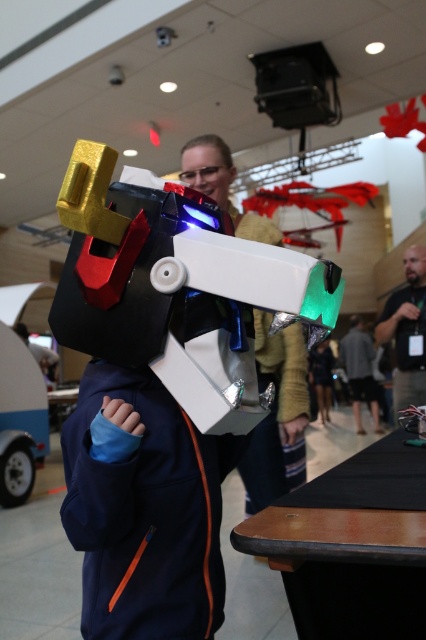
Between dark brown hair at center and matte black helmet at center, which one has less height?

Standing shorter between the two is matte black helmet at center.

Is point (414, 248) farther from viewer compared to point (353, 326)?

No, it is not.

Does point (411, 262) come behind point (353, 317)?

No.

At what (x,y) coordinates should I click in order to perform the action: click on dark brown hair at center. Please return your answer as a coordinate pair (x, y). This screenshot has height=640, width=426. Looking at the image, I should click on (414, 264).

Is point (189, 164) more distant than point (356, 320)?

No.

Who is shorter, matte plastic head at center or matte black helmet at center?

matte black helmet at center

Is point (203, 179) positioned behind point (354, 321)?

No, (203, 179) is closer to viewer.

I want to click on matte plastic head at center, so [207, 168].

Describe the element at coordinates (406, 332) in the screenshot. Image resolution: width=426 pixels, height=640 pixels. I see `dark brown leather jacket at lower right` at that location.

Is dark brown leather jacket at lower right behind dark gray fabric jacket at center?

That is False.

Find the location of `dark brown leather jacket at lower right`. dark brown leather jacket at lower right is located at coordinates (406, 332).

Find the location of a particular element. The width and height of the screenshot is (426, 640). dark brown leather jacket at lower right is located at coordinates (406, 332).